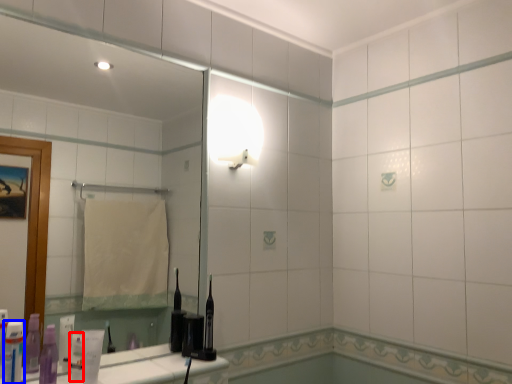
Question: Which object appears closest to the camera in this image, toiletry (highlighted by a red box) or toiletry (highlighted by a blue box)?

Choices:
 (A) toiletry
 (B) toiletry

Answer: (B)